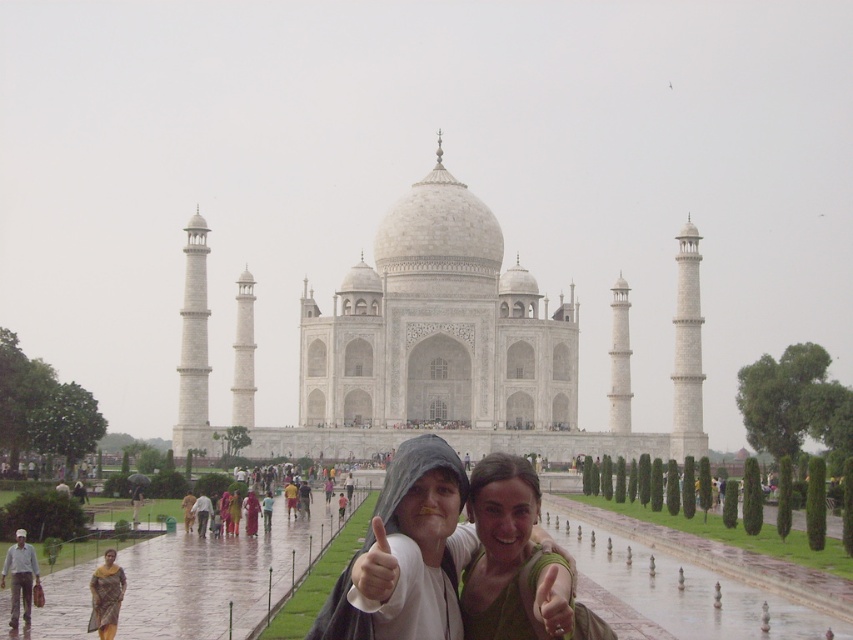
Who is more forward, (108, 602) or (254, 499)?

Point (108, 602)

Can you confirm if yellow plaid sari at lower left is thinner than matte white hoodie at center?

Indeed, yellow plaid sari at lower left has a lesser width compared to matte white hoodie at center.

What do you see at coordinates (106, 596) in the screenshot?
I see `yellow plaid sari at lower left` at bounding box center [106, 596].

At what (x,y) coordinates should I click in order to perform the action: click on yellow plaid sari at lower left. Please return your answer as a coordinate pair (x, y). This screenshot has height=640, width=853. Looking at the image, I should click on (106, 596).

Who is lower down, light gray cotton shirt at lower left or matte white hoodie at center?

light gray cotton shirt at lower left is below.

What do you see at coordinates (20, 577) in the screenshot? This screenshot has width=853, height=640. I see `light gray cotton shirt at lower left` at bounding box center [20, 577].

The image size is (853, 640). Identify the location of light gray cotton shirt at lower left. (20, 577).

Which is above, light gray cotton shirt at lower left or light gray cotton shirt at center?

Positioned higher is light gray cotton shirt at center.

Who is lower down, light gray cotton shirt at lower left or light gray cotton shirt at center?

light gray cotton shirt at lower left is below.

Which is behind, point (12, 598) or point (198, 524)?

Positioned behind is point (198, 524).

Find the location of a particular element. The width and height of the screenshot is (853, 640). light gray cotton shirt at lower left is located at coordinates [20, 577].